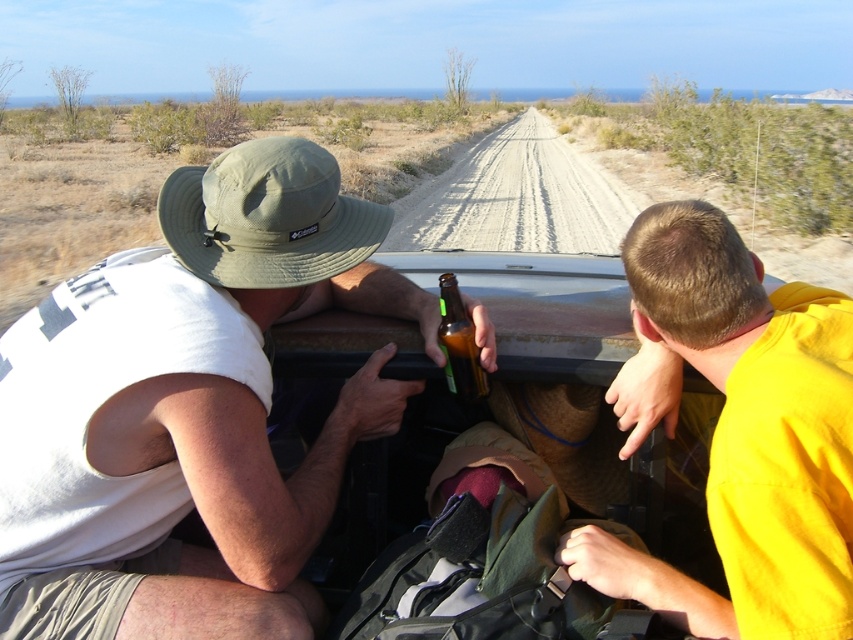
Question: Which object appears farthest from the camera in this image?

Choices:
 (A) yellow matte truck at right
 (B) matte green hat at upper left
 (C) brown glass bottle at center

Answer: (C)

Question: Is matte green hat at upper left below brown glass bottle at center?

Choices:
 (A) yes
 (B) no

Answer: (A)

Question: Which point is farther from the camera taking this photo?

Choices:
 (A) (177, 556)
 (B) (456, 333)
 (C) (744, 532)

Answer: (B)

Question: Is matte green hat at upper left to the left of yellow matte truck at right from the viewer's perspective?

Choices:
 (A) no
 (B) yes

Answer: (B)

Question: In this image, where is matte green hat at upper left located relative to brown glass bottle at center?

Choices:
 (A) right
 (B) left

Answer: (B)

Question: Based on their relative distances, which object is farther from the matte green hat at upper left?

Choices:
 (A) brown glass bottle at center
 (B) yellow matte truck at right

Answer: (B)